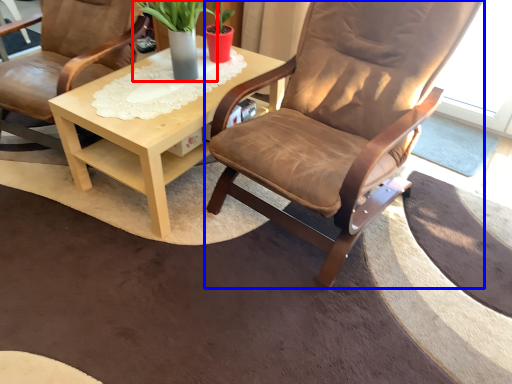
Question: Which object appears farthest to the camera in this image, houseplant (highlighted by a red box) or chair (highlighted by a blue box)?

Choices:
 (A) houseplant
 (B) chair

Answer: (A)